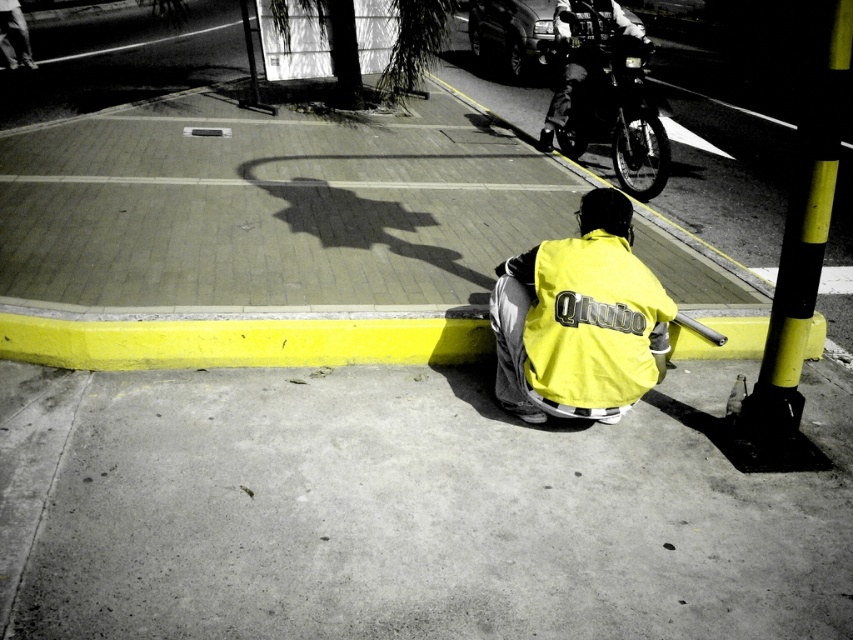
Question: Can you confirm if yellow painted curb at lower center is positioned to the left of yellow matte safety vest at lower center?

Choices:
 (A) yes
 (B) no

Answer: (A)

Question: Which of the following is the farthest from the observer?

Choices:
 (A) yellow matte safety vest at lower center
 (B) black matte motorcycle at upper right
 (C) yellow/black striped pole at right
 (D) gray concrete pavement at lower center

Answer: (B)

Question: Does gray concrete pavement at lower center lie behind black matte motorcycle at upper right?

Choices:
 (A) yes
 (B) no

Answer: (B)

Question: Does gray concrete pavement at lower center have a larger size compared to black matte motorcycle at upper right?

Choices:
 (A) yes
 (B) no

Answer: (B)

Question: Considering the real-world distances, which object is closest to the yellow/black striped pole at right?

Choices:
 (A) yellow painted curb at lower center
 (B) gray concrete pavement at lower center

Answer: (B)

Question: Which point is closer to the camera taking this photo?

Choices:
 (A) (643, 40)
 (B) (834, 90)

Answer: (B)